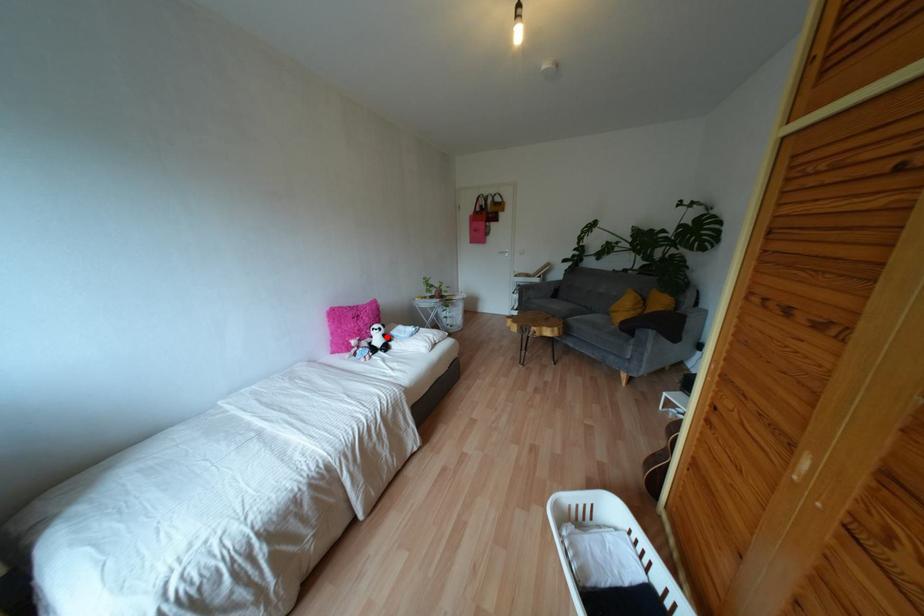
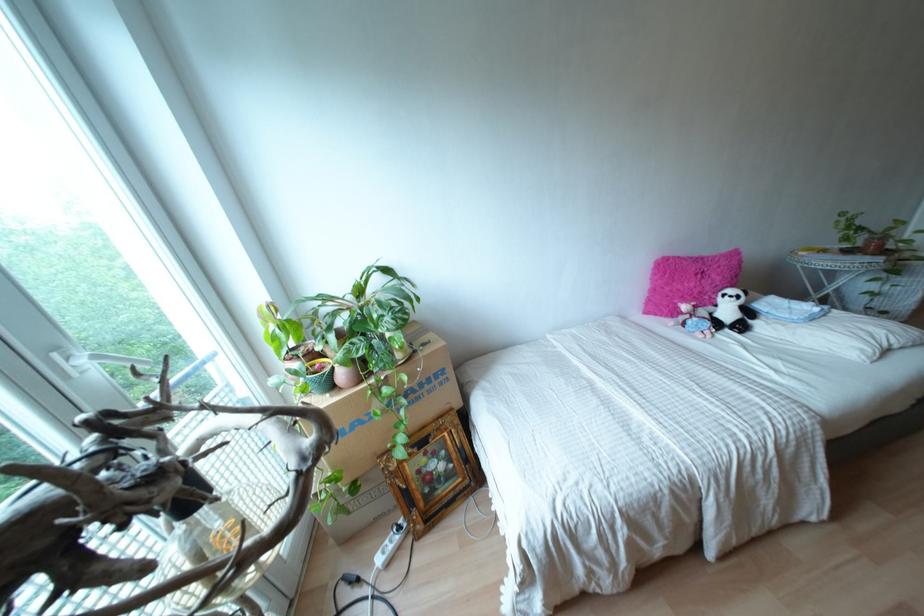
Where in the second image is the point corresponding to the highlighted location from the first image?

(747, 312)